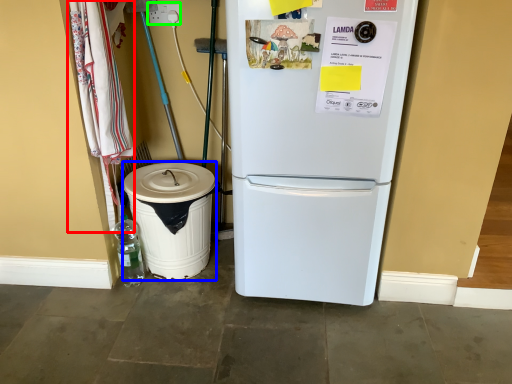
Question: Which object is positioned farthest from laundry (highlighted by a red box)? Select from trash bin/can (highlighted by a blue box) and electric outlet (highlighted by a green box).

Choices:
 (A) trash bin/can
 (B) electric outlet

Answer: (B)